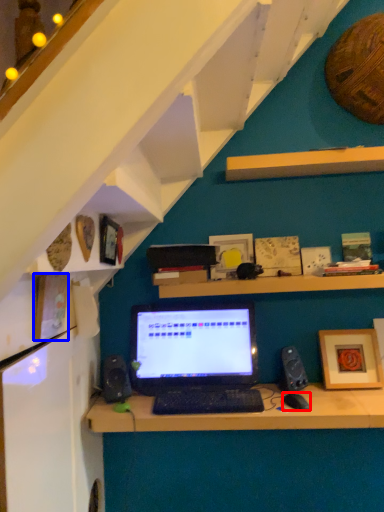
Question: Among these objects, which one is farthest to the camera, computer mouse (highlighted by a red box) or picture frame (highlighted by a blue box)?

Choices:
 (A) computer mouse
 (B) picture frame

Answer: (A)